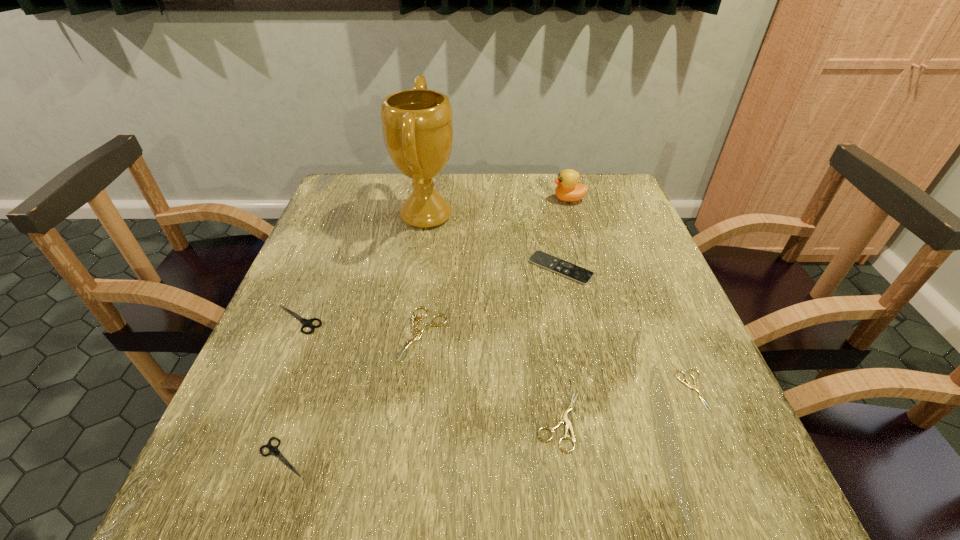
The width and height of the screenshot is (960, 540). I want to click on free space located on the back of the nearer black shears, so click(x=338, y=293).

Locate an element on the screen. The width and height of the screenshot is (960, 540). vacant space located on the left of the shortest shears is located at coordinates (462, 390).

Locate an element on the screen. The image size is (960, 540). award present at the far edge is located at coordinates (417, 125).

Locate an element on the screen. duckling that is at the far edge is located at coordinates (568, 189).

The width and height of the screenshot is (960, 540). Find the location of `object that is at the near edge`. object that is at the near edge is located at coordinates (273, 450).

Identify the location of duckling present at the right edge. The width and height of the screenshot is (960, 540). [568, 189].

Locate an element on the screen. shears that is at the right edge is located at coordinates (695, 387).

Locate an element on the screen. The height and width of the screenshot is (540, 960). object positioned at the near left corner is located at coordinates (273, 450).

Where is `object present at the far right corner`? object present at the far right corner is located at coordinates (568, 189).

In order to click on free region at the far edge of the desktop in this screenshot , I will do `click(502, 176)`.